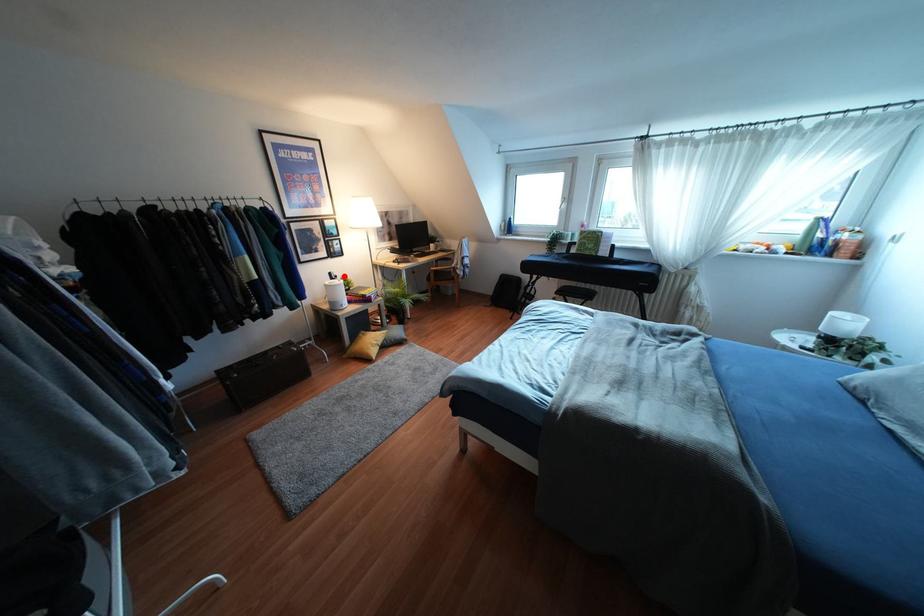
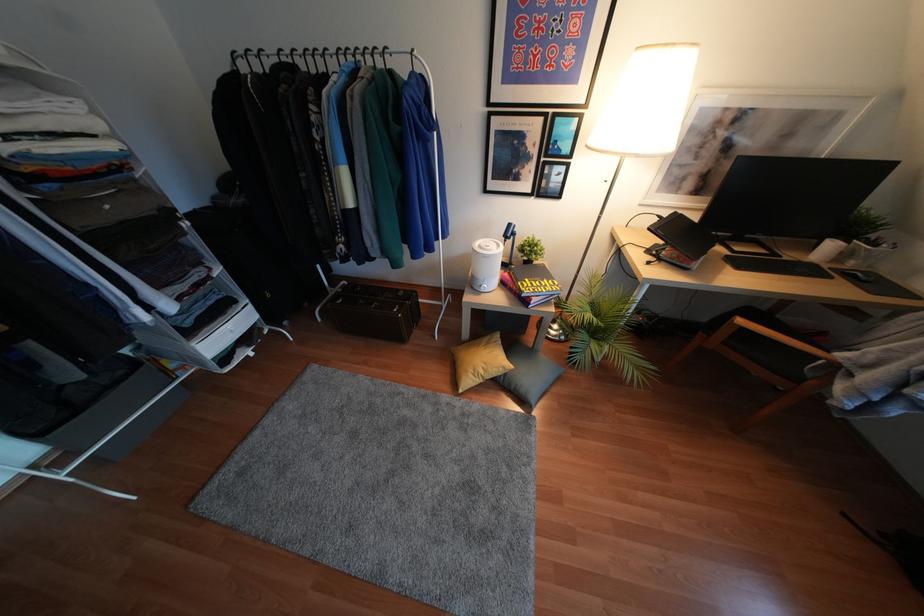
Question: I am providing you with two images of the same scene from different viewpoints. In image1, a red point is highlighted. Considering the same 3D point in image2, which of the following is correct?

Choices:
 (A) It is closer
 (B) It is farther

Answer: (A)